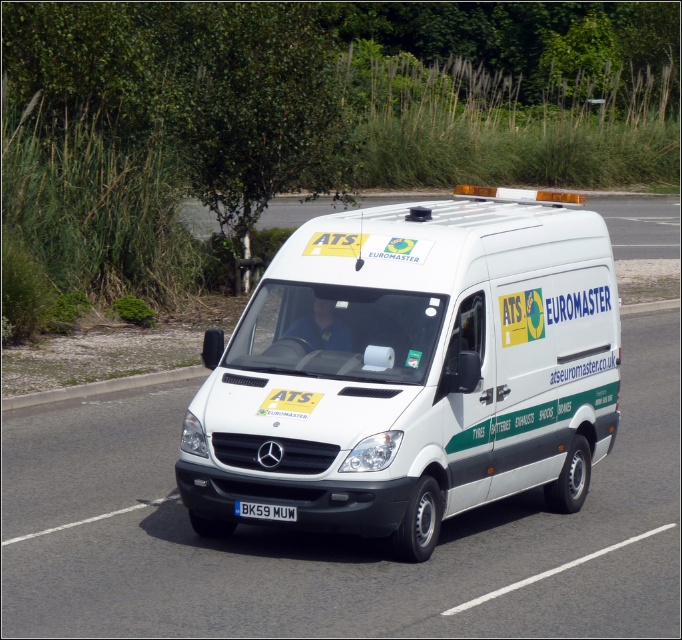
Between point (449, 500) and point (256, 502), which one is positioned in front?

Point (256, 502) is more forward.

Between white matte van at center and black plastic license plate at lower center, which one appears on the left side from the viewer's perspective?

black plastic license plate at lower center

Is point (213, 476) closer to viewer compared to point (265, 513)?

No, it is behind (265, 513).

Find the location of a particular element. white matte van at center is located at coordinates (411, 371).